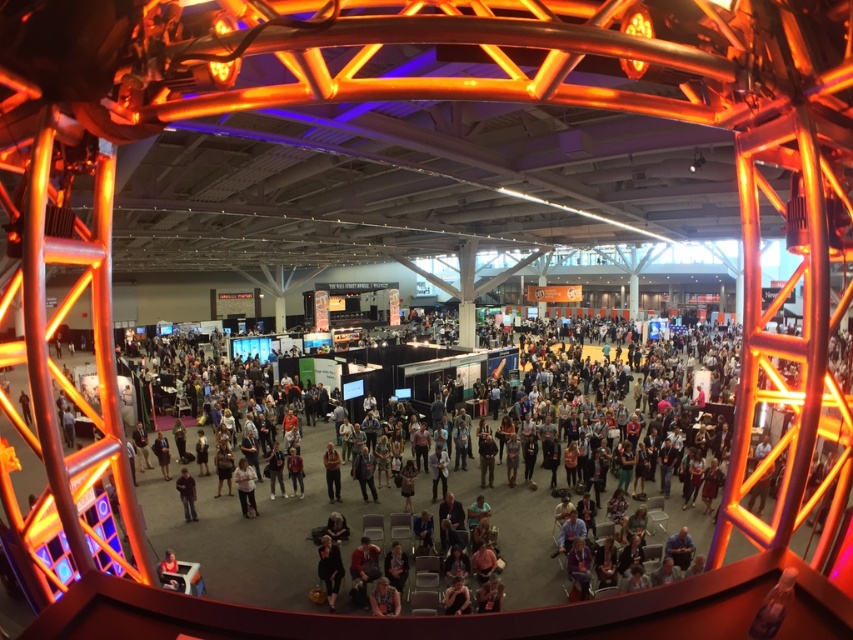
Question: Which point appears farthest from the camera in this image?

Choices:
 (A) (184, 486)
 (B) (338, 456)
 (C) (650, 548)

Answer: (B)

Question: Does black fabric jacket at lower center appear on the right side of light brown leather jacket at center?

Choices:
 (A) no
 (B) yes

Answer: (B)

Question: Estimate the real-world distances between objects in this image. Which object is farther from the dark gray shirt at center?

Choices:
 (A) light brown fabric shirt at center
 (B) light brown leather jacket at center
 (C) dark gray shirt at lower center

Answer: (C)

Question: Is light brown fabric shirt at center wider than dark gray shirt at lower center?

Choices:
 (A) no
 (B) yes

Answer: (A)

Question: Which of the following is the farthest from the observer?

Choices:
 (A) click(x=190, y=476)
 (B) click(x=241, y=481)

Answer: (A)

Question: From the image, what is the correct spatial relationship of black fabric jacket at lower center in relation to dark gray shirt at lower center?

Choices:
 (A) below
 (B) above

Answer: (A)